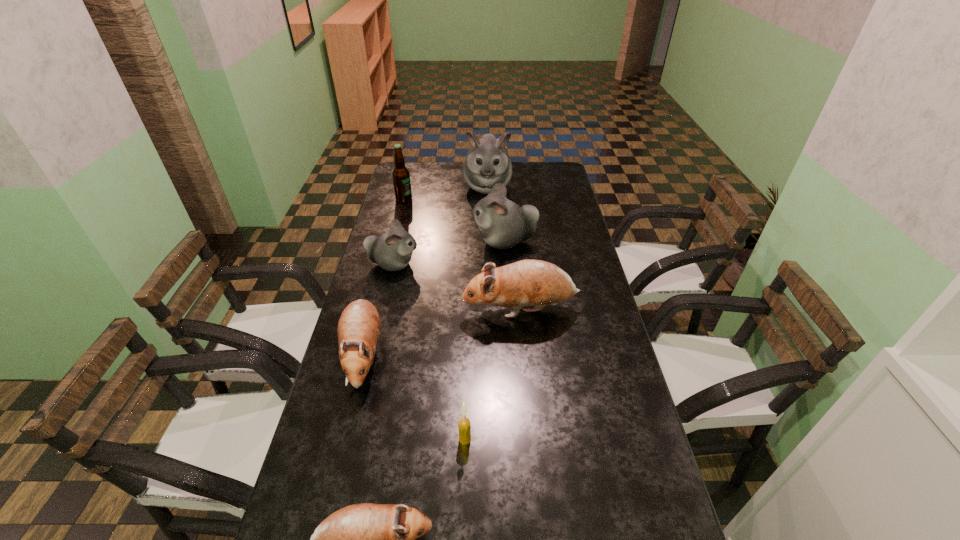
Identify the location of vacant area situated on the label of the brown beer bottle. This screenshot has height=540, width=960. (474, 199).

This screenshot has height=540, width=960. I want to click on free space located on the face of the second smallest white hamster, so click(x=459, y=241).

The height and width of the screenshot is (540, 960). I want to click on free spot located on the face of the second smallest white hamster, so click(396, 241).

You are a GUI agent. You are given a task and a screenshot of the screen. Output one action in this format:
    pyautogui.click(x=<x>, y=<y>)
    Task: Click on the vacant area situated 0.330m on the face of the second smallest white hamster
    The height and width of the screenshot is (540, 960).
    Given the screenshot: What is the action you would take?
    pyautogui.click(x=383, y=241)

Where is `free region located at the face of the biggest brown hamster`? free region located at the face of the biggest brown hamster is located at coordinates (404, 310).

Find the location of a particular element. This screenshot has height=540, width=960. free location located 0.270m at the face of the biggest brown hamster is located at coordinates (375, 310).

Where is `vacant region located 0.330m at the face of the biggest brown hamster`? The image size is (960, 540). vacant region located 0.330m at the face of the biggest brown hamster is located at coordinates pyautogui.click(x=356, y=310).

Locate an element on the screen. The height and width of the screenshot is (540, 960). vacant space located 0.070m on the face of the leftmost white hamster is located at coordinates (440, 265).

You are a GUI agent. You are given a task and a screenshot of the screen. Output one action in this format:
    pyautogui.click(x=<x>, y=<y>)
    Task: Click on the vacant space located 0.210m at the face of the second biggest brown hamster
    
    Given the screenshot: What is the action you would take?
    pyautogui.click(x=331, y=484)

Locate an element on the screen. The height and width of the screenshot is (540, 960). vacant space situated 0.050m on the left of the second nearest object is located at coordinates (438, 439).